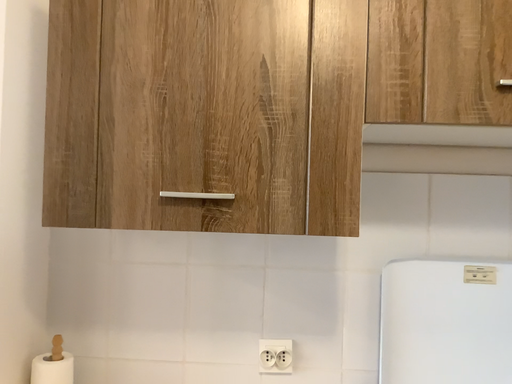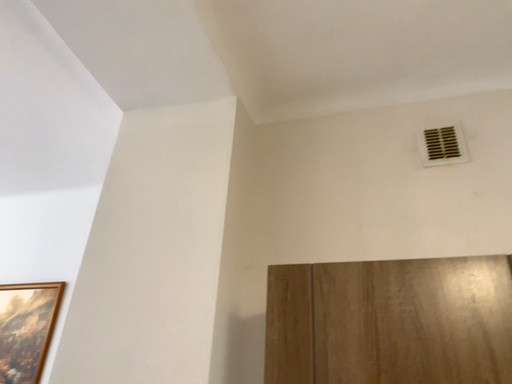
Question: How did the camera likely rotate when shooting the video?

Choices:
 (A) rotated upward
 (B) rotated downward

Answer: (A)